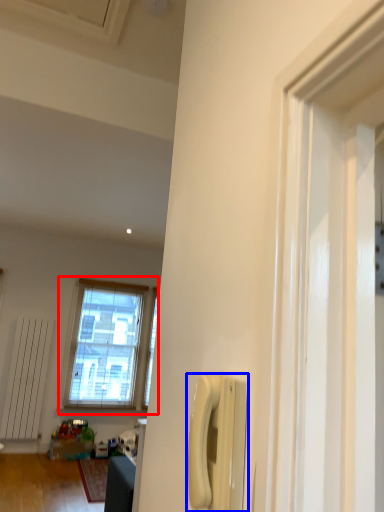
Question: Which of the following is the farthest to the observer, window (highlighted by a red box) or corded phone (highlighted by a blue box)?

Choices:
 (A) window
 (B) corded phone

Answer: (A)